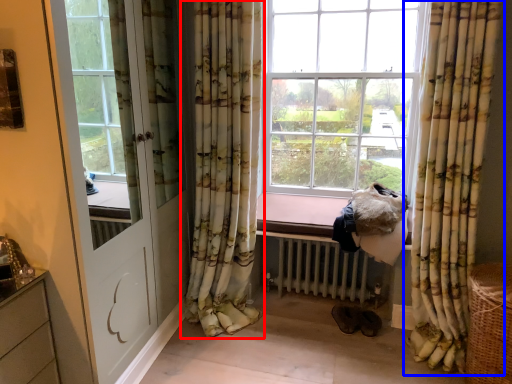
Question: Which object appears closest to the camera in this image, curtain (highlighted by a red box) or curtain (highlighted by a blue box)?

Choices:
 (A) curtain
 (B) curtain

Answer: (B)